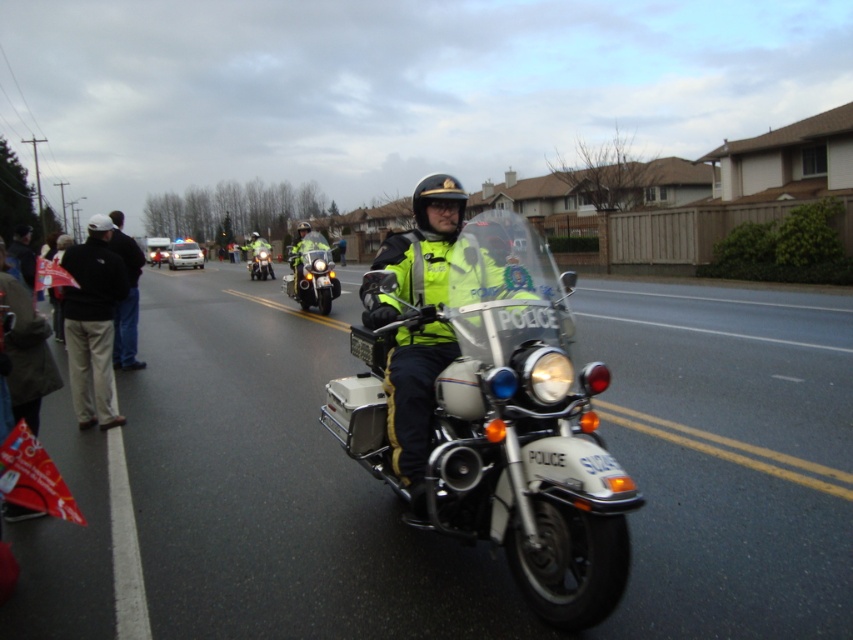
You are a pedestrian standing on the sidewalk next to the road. You see the white metallic police motorcycle at center and the black fabric jacket at left. Which object is taller?

The white metallic police motorcycle at center is taller than the black fabric jacket at left.

You are a pedestrian standing on the sidewalk observing the scene. You notice the reflective yellow vest at center and the metallic silver motorcycle at center. Which object is closer to you, the observer?

The reflective yellow vest at center is positioned over the metallic silver motorcycle at center, so it is closer to you as the observer.

You are a pedestrian standing on the sidewalk. You see the white metallic police motorcycle at center and the black fabric jacket at left. Which object takes up more horizontal space in the image?

The white metallic police motorcycle at center takes up more horizontal space because its width is larger than the black fabric jacket at left.